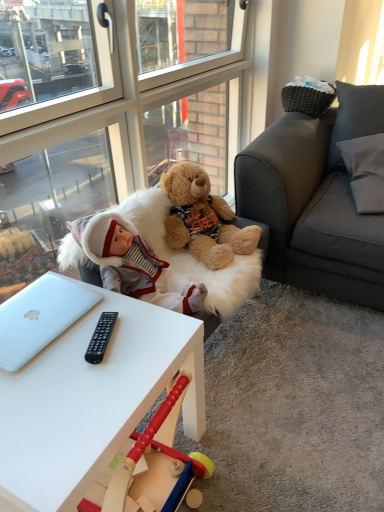
This screenshot has height=512, width=384. I want to click on unoccupied area in front of silver metallic laptop at lower left, so click(x=52, y=385).